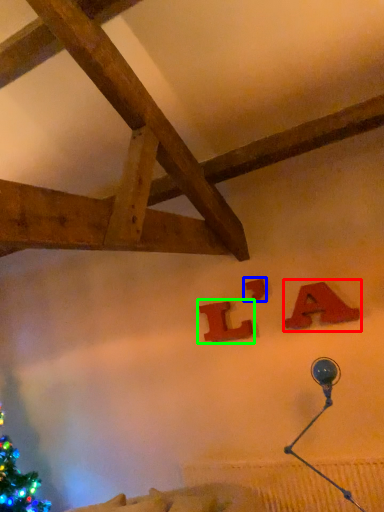
Question: Which object is positioned farthest from alphabet (highlighted by a red box)? Select from alphabet (highlighted by a blue box) and alphabet (highlighted by a green box).

Choices:
 (A) alphabet
 (B) alphabet

Answer: (B)